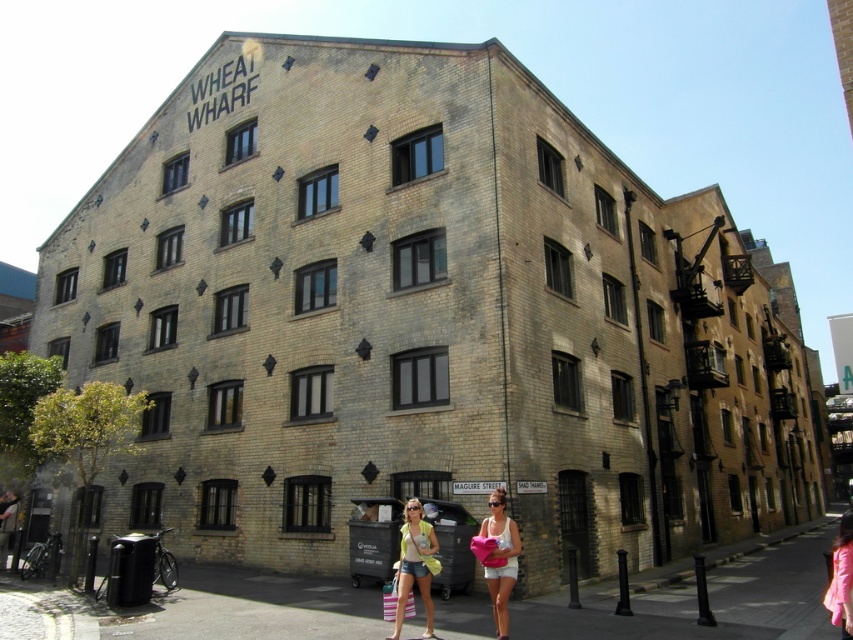
Question: Is yellow cotton tank top at lower center above pink fabric at lower right?

Choices:
 (A) yes
 (B) no

Answer: (A)

Question: Can you confirm if yellow cotton tank top at lower center is smaller than pink fabric at lower right?

Choices:
 (A) no
 (B) yes

Answer: (B)

Question: Which object is farther from the camera taking this photo?

Choices:
 (A) matte white shorts at lower center
 (B) smooth concrete pavement at lower center
 (C) pink fabric at lower right

Answer: (B)

Question: Among these objects, which one is nearest to the camera?

Choices:
 (A) pink fabric at lower right
 (B) smooth concrete pavement at lower center
 (C) yellow cotton tank top at lower center

Answer: (A)

Question: Which object appears farthest from the camera in this image?

Choices:
 (A) matte white shorts at lower center
 (B) pink fabric at lower right
 (C) yellow cotton tank top at lower center
 (D) smooth concrete pavement at lower center

Answer: (C)

Question: Can you confirm if yellow cotton tank top at lower center is bigger than pink fabric at lower right?

Choices:
 (A) yes
 (B) no

Answer: (B)